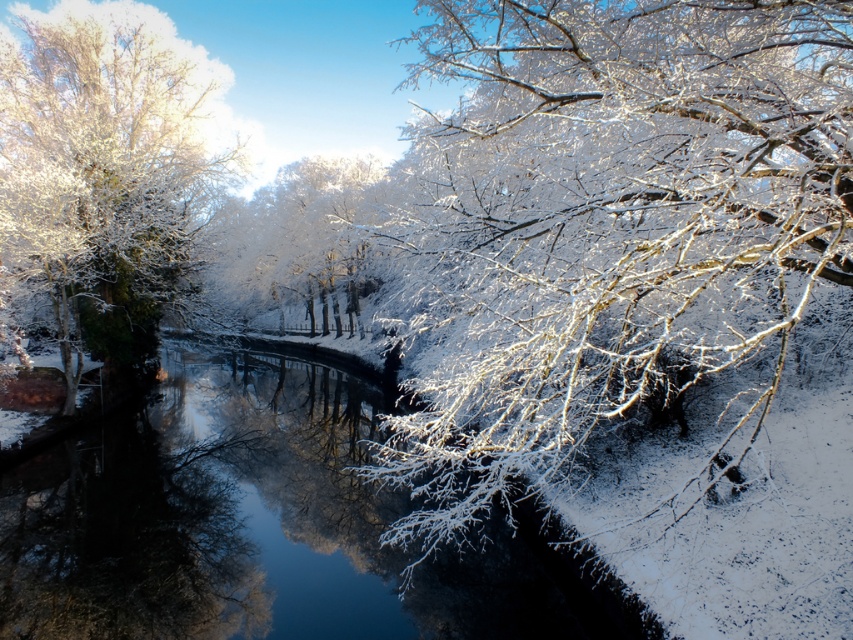
Question: Based on their relative distances, which object is farther from the white frosty branches at upper right?

Choices:
 (A) white frosty tree at left
 (B) clear ice water at center

Answer: (A)

Question: Is white frosty branches at upper right thinner than clear ice water at center?

Choices:
 (A) no
 (B) yes

Answer: (B)

Question: Based on their relative distances, which object is nearer to the white frosty branches at upper right?

Choices:
 (A) clear ice water at center
 (B) white frosty tree at left

Answer: (A)

Question: Does white frosty branches at upper right have a smaller size compared to white frosty tree at left?

Choices:
 (A) no
 (B) yes

Answer: (A)

Question: Which point is closer to the camera taking this photo?

Choices:
 (A) (180, 282)
 (B) (352, 573)
 (C) (578, 404)

Answer: (C)

Question: Does white frosty branches at upper right have a lesser width compared to clear ice water at center?

Choices:
 (A) no
 (B) yes

Answer: (B)